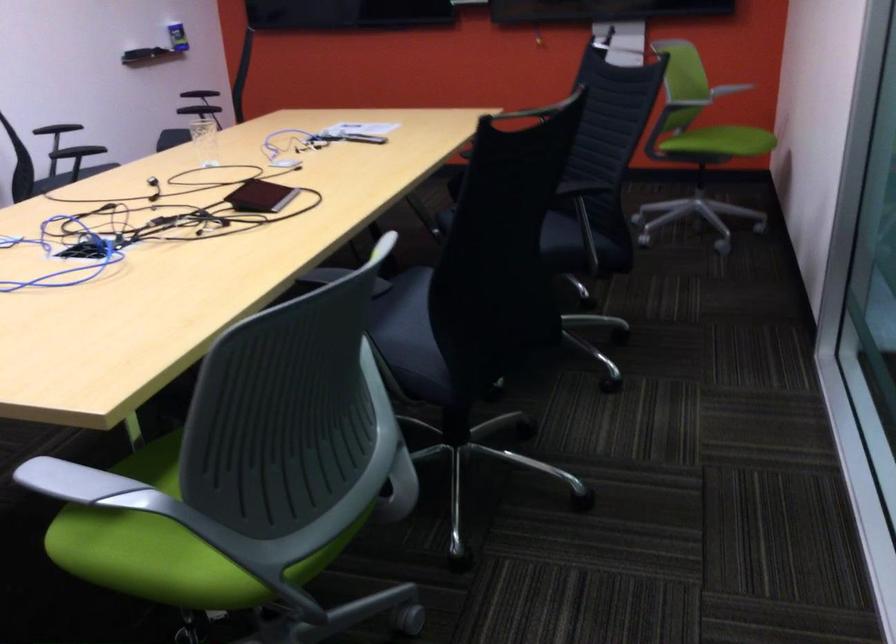
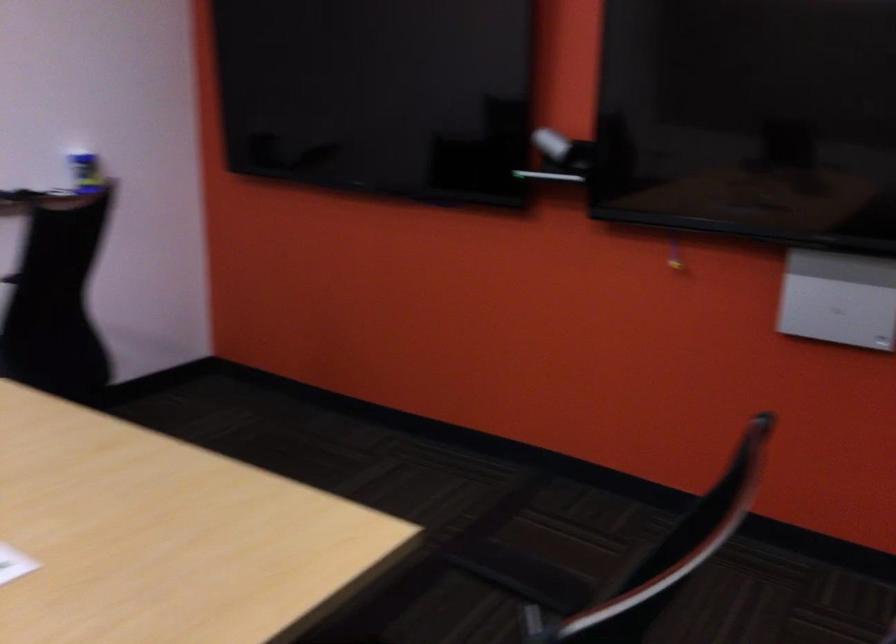
Question: In a continuous first-person perspective shot, in which direction is the camera moving?

Choices:
 (A) Left
 (B) Right
 (C) Forward
 (D) Backward

Answer: (C)